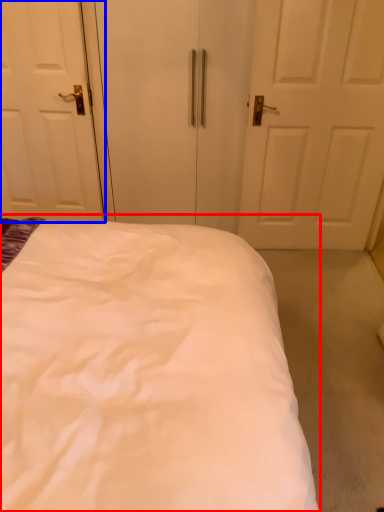
Question: Which point is further to the camera, bed (highlighted by a red box) or door (highlighted by a blue box)?

Choices:
 (A) bed
 (B) door

Answer: (B)